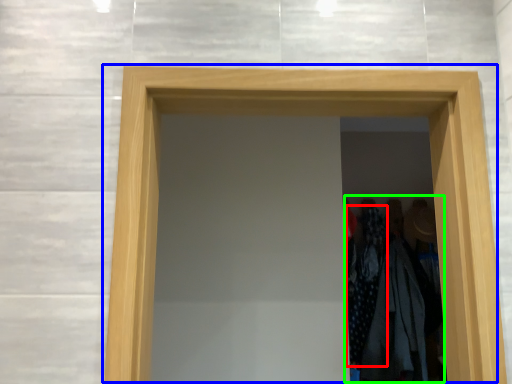
Question: Which is farther away from clothing (highlighted by a red box)? door (highlighted by a blue box) or laundry (highlighted by a green box)?

Choices:
 (A) door
 (B) laundry

Answer: (A)